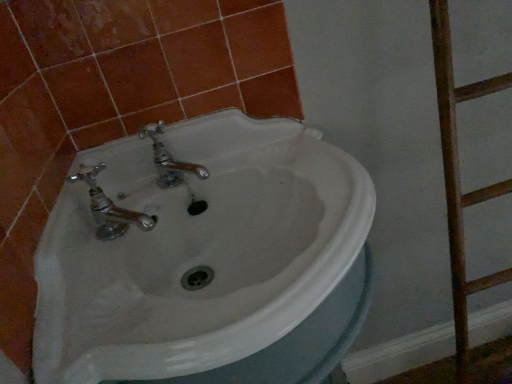
Question: Is white glossy sink at center not near rusty wood ladder at right?

Choices:
 (A) yes
 (B) no

Answer: (B)

Question: Considering the relative sizes of white glossy sink at center and rusty wood ladder at right in the image provided, is white glossy sink at center bigger than rusty wood ladder at right?

Choices:
 (A) no
 (B) yes

Answer: (B)

Question: Is white glossy sink at center not inside rusty wood ladder at right?

Choices:
 (A) yes
 (B) no

Answer: (A)

Question: From the image's perspective, is white glossy sink at center located above rusty wood ladder at right?

Choices:
 (A) yes
 (B) no

Answer: (B)

Question: Is white glossy sink at center facing towards rusty wood ladder at right?

Choices:
 (A) no
 (B) yes

Answer: (A)

Question: Does white glossy sink at center come in front of rusty wood ladder at right?

Choices:
 (A) no
 (B) yes

Answer: (B)

Question: Can you confirm if rusty wood ladder at right is thinner than white glossy sink at center?

Choices:
 (A) no
 (B) yes

Answer: (B)

Question: Considering the relative positions of rusty wood ladder at right and white glossy sink at center in the image provided, is rusty wood ladder at right to the left of white glossy sink at center from the viewer's perspective?

Choices:
 (A) yes
 (B) no

Answer: (B)

Question: From a real-world perspective, is rusty wood ladder at right under white glossy sink at center?

Choices:
 (A) no
 (B) yes

Answer: (A)

Question: Is rusty wood ladder at right not inside white glossy sink at center?

Choices:
 (A) yes
 (B) no

Answer: (A)

Question: Is rusty wood ladder at right facing towards white glossy sink at center?

Choices:
 (A) yes
 (B) no

Answer: (B)

Question: From a real-world perspective, is rusty wood ladder at right located higher than white glossy sink at center?

Choices:
 (A) no
 (B) yes

Answer: (B)

Question: From the image's perspective, is white glossy sink at center located above or below rusty wood ladder at right?

Choices:
 (A) above
 (B) below

Answer: (B)